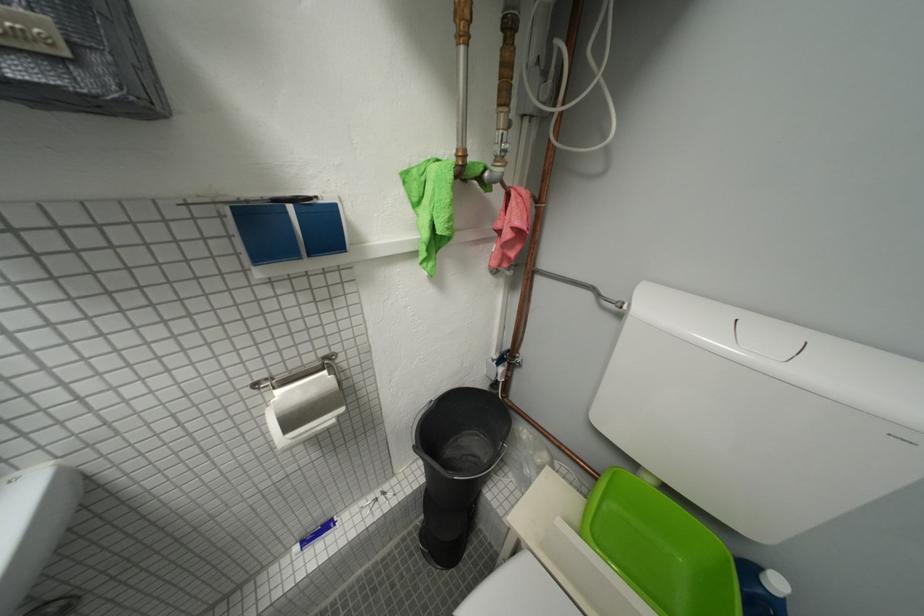
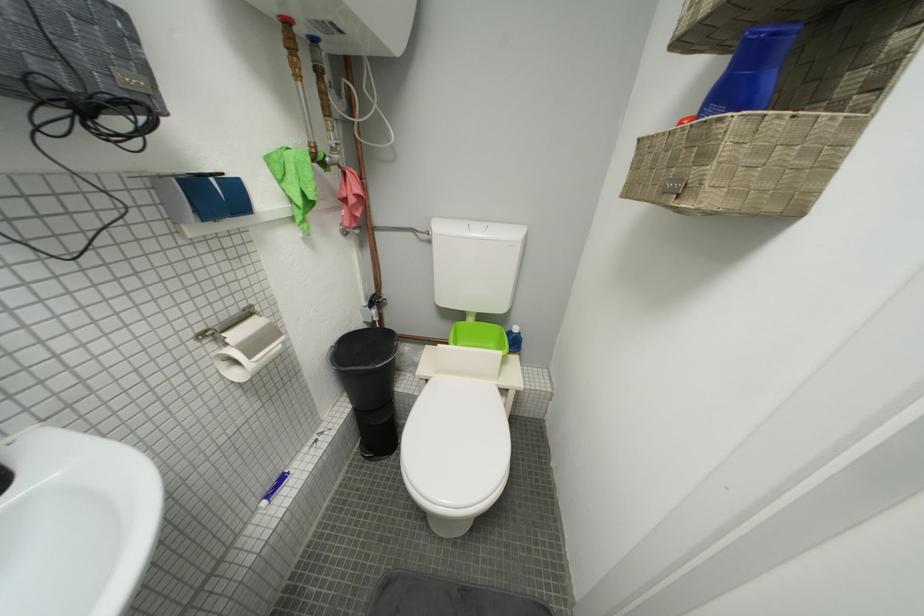
Question: How did the camera likely rotate?

Choices:
 (A) Left
 (B) Right
 (C) Up
 (D) Down

Answer: (B)